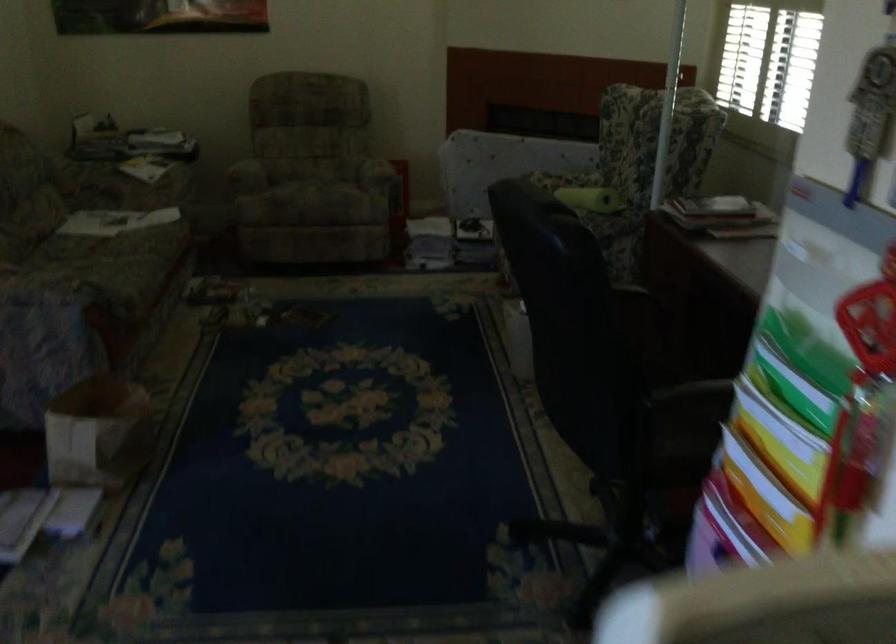
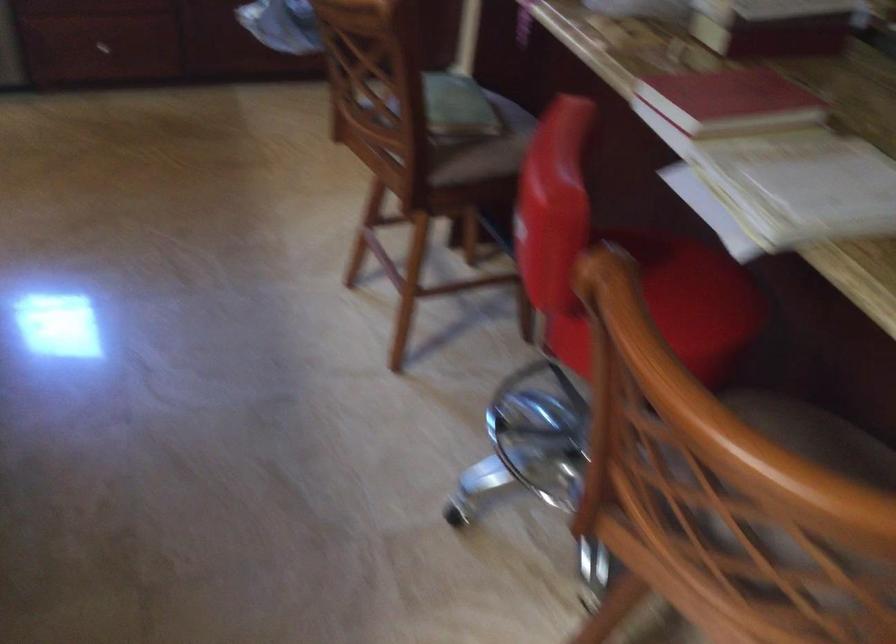
The images are taken continuously from a first-person perspective. In which direction is your viewpoint rotating?

The rotation direction of the camera is left-down.